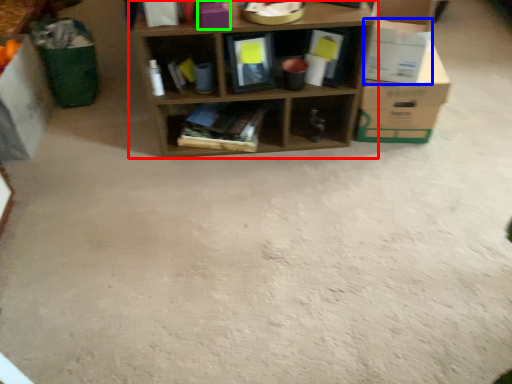
Question: Which is nearer to the shelf (highlighted by a red box)? cardboard box (highlighted by a blue box) or storage box (highlighted by a green box).

Choices:
 (A) cardboard box
 (B) storage box

Answer: (A)